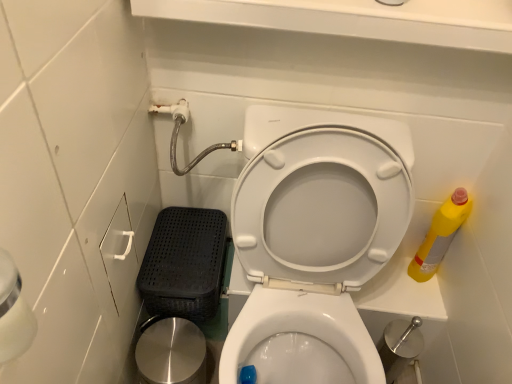
What do you see at coordinates (314, 240) in the screenshot?
I see `white glossy toilet seat at center` at bounding box center [314, 240].

The width and height of the screenshot is (512, 384). What do you see at coordinates (170, 353) in the screenshot?
I see `polished stainless steel potty at lower left` at bounding box center [170, 353].

The height and width of the screenshot is (384, 512). Identify the location of yellow plastic bottle at right. (440, 235).

Is yellow plastic bottle at right not inside polished stainless steel potty at lower left?

Yes, yellow plastic bottle at right is located beyond the bounds of polished stainless steel potty at lower left.

From a real-world perspective, is yellow plastic bottle at right above or below polished stainless steel potty at lower left?

Clearly, from a real-world perspective, yellow plastic bottle at right is above polished stainless steel potty at lower left.

Is polished stainless steel potty at lower left taller than white glossy toilet seat at center?

A: No.

Is polished stainless steel potty at lower left turned away from white glossy toilet seat at center?

No.

Is polished stainless steel potty at lower left in front of white glossy toilet seat at center?

No, it is behind white glossy toilet seat at center.

From the image's perspective, who appears lower, white glossy toilet seat at center or yellow plastic bottle at right?

From the image's view, white glossy toilet seat at center is below.

Is the position of white glossy toilet seat at center more distant than that of yellow plastic bottle at right?

That is False.

Which of these two, white glossy toilet seat at center or yellow plastic bottle at right, is wider?

white glossy toilet seat at center.

Who is smaller, white glossy toilet seat at center or yellow plastic bottle at right?

Smaller between the two is yellow plastic bottle at right.

Does yellow plastic bottle at right turn towards white glossy toilet seat at center?

No, yellow plastic bottle at right is not facing towards white glossy toilet seat at center.

How far apart are yellow plastic bottle at right and white glossy toilet seat at center?

A distance of 15.43 inches exists between yellow plastic bottle at right and white glossy toilet seat at center.

Can you confirm if yellow plastic bottle at right is positioned to the left of white glossy toilet seat at center?

No, yellow plastic bottle at right is not to the left of white glossy toilet seat at center.

Considering the relative sizes of yellow plastic bottle at right and white glossy toilet seat at center in the image provided, is yellow plastic bottle at right bigger than white glossy toilet seat at center?

Actually, yellow plastic bottle at right might be smaller than white glossy toilet seat at center.

In the scene shown: Is white glossy toilet seat at center positioned with its back to polished stainless steel potty at lower left?

No, white glossy toilet seat at center is not facing away from polished stainless steel potty at lower left.

Is the surface of white glossy toilet seat at center in direct contact with polished stainless steel potty at lower left?

No, white glossy toilet seat at center is not next to polished stainless steel potty at lower left.

From the image's perspective, would you say white glossy toilet seat at center is shown under polished stainless steel potty at lower left?

Incorrect, from the image's perspective, white glossy toilet seat at center is higher than polished stainless steel potty at lower left.

Image resolution: width=512 pixels, height=384 pixels. Identify the location of potty below the white glossy toilet seat at center (from the image's perspective). pos(170,353).

Would you say polished stainless steel potty at lower left is to the left or to the right of yellow plastic bottle at right in the picture?

Clearly, polished stainless steel potty at lower left is on the left of yellow plastic bottle at right in the image.

From the image's perspective, is polished stainless steel potty at lower left above or below yellow plastic bottle at right?

Clearly, from the image's perspective, polished stainless steel potty at lower left is below yellow plastic bottle at right.

Is polished stainless steel potty at lower left taller than yellow plastic bottle at right?

Incorrect, the height of polished stainless steel potty at lower left is not larger of that of yellow plastic bottle at right.

Is polished stainless steel potty at lower left looking in the opposite direction of yellow plastic bottle at right?

No, yellow plastic bottle at right is not at the back of polished stainless steel potty at lower left.

This screenshot has width=512, height=384. What are the coordinates of `cleaning product above the polished stainless steel potty at lower left (from the image's perspective)` in the screenshot? It's located at (440, 235).

Where is `potty on the left side of white glossy toilet seat at center`? potty on the left side of white glossy toilet seat at center is located at coordinates (170, 353).

From the image, which object appears to be farther from white glossy toilet seat at center, yellow plastic bottle at right or polished stainless steel potty at lower left?

Among the two, yellow plastic bottle at right is located further to white glossy toilet seat at center.

Estimate the real-world distances between objects in this image. Which object is further from yellow plastic bottle at right, polished stainless steel potty at lower left or white glossy toilet seat at center?

polished stainless steel potty at lower left is positioned further to the anchor yellow plastic bottle at right.

When comparing their distances from yellow plastic bottle at right, does white glossy toilet seat at center or polished stainless steel potty at lower left seem further?

The object further to yellow plastic bottle at right is polished stainless steel potty at lower left.

From the image, which object appears to be farther from polished stainless steel potty at lower left, white glossy toilet seat at center or yellow plastic bottle at right?

The object further to polished stainless steel potty at lower left is yellow plastic bottle at right.

In the scene shown: Looking at the image, which one is located further to polished stainless steel potty at lower left, yellow plastic bottle at right or white glossy toilet seat at center?

yellow plastic bottle at right lies further to polished stainless steel potty at lower left than the other object.

Which object lies nearer to the anchor point white glossy toilet seat at center, polished stainless steel potty at lower left or yellow plastic bottle at right?

Based on the image, polished stainless steel potty at lower left appears to be nearer to white glossy toilet seat at center.

In order to click on toilet between polished stainless steel potty at lower left and yellow plastic bottle at right in the horizontal direction in this screenshot , I will do `click(314, 240)`.